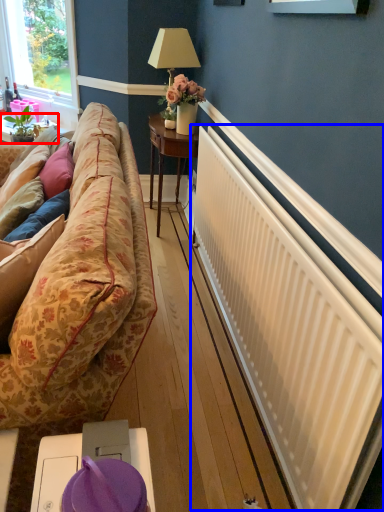
Question: Which object is closer to the camera taking this photo, table (highlighted by a red box) or radiator (highlighted by a blue box)?

Choices:
 (A) table
 (B) radiator

Answer: (B)